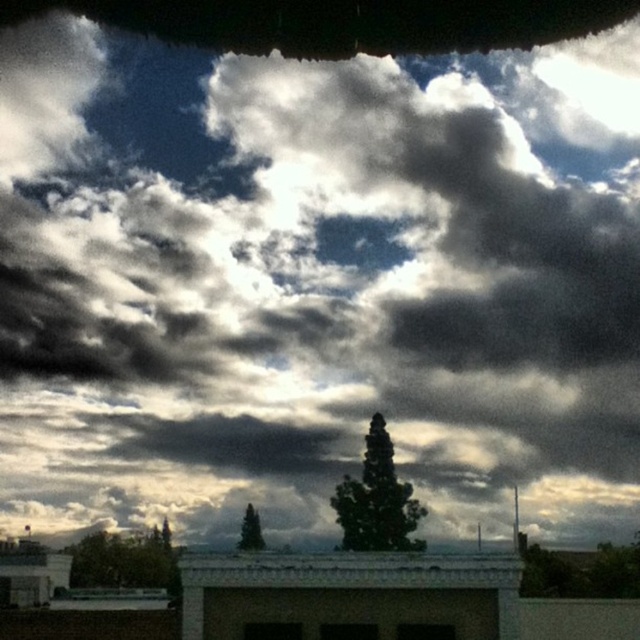
You are standing in a park and see the green leafy tree at center. If you want to take a photo of it, where should you position yourself relative to the tree to ensure it is centered in your camera viewfinder?

To center the green leafy tree at center in your camera viewfinder, position yourself directly in front of the tree at the point specified by its 2D coordinates, which is at location (376, 500).

You are an architect designing a new building. You want to ensure that the green leafy tree at center and the green matte tree at center are visible from the main entrance. Based on their positions, which tree will appear closer to the entrance?

The green leafy tree at center will appear closer to the entrance because it is positioned in front of the green matte tree at center.

You are standing in front of the building and see the green leafy tree at lower left and the green matte tree at center. Which tree is closer to your left side?

The green leafy tree at lower left is positioned on the left side of green matte tree at center, so it is closer to your left side.